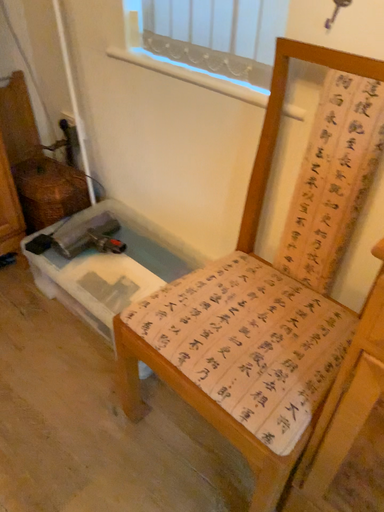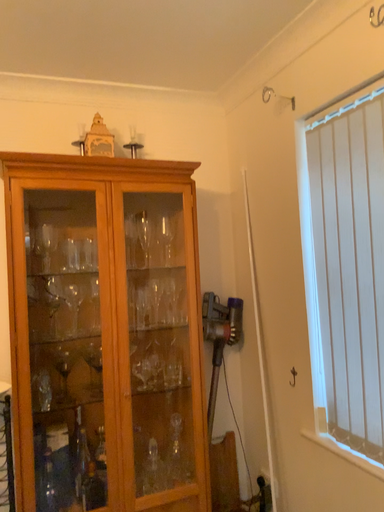
Question: How did the camera likely rotate when shooting the video?

Choices:
 (A) rotated downward
 (B) rotated upward

Answer: (B)